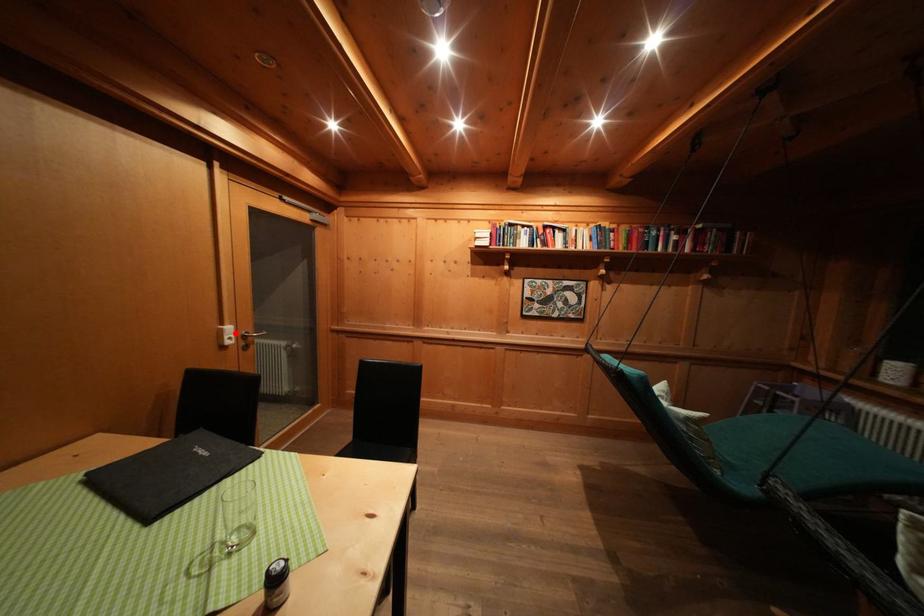
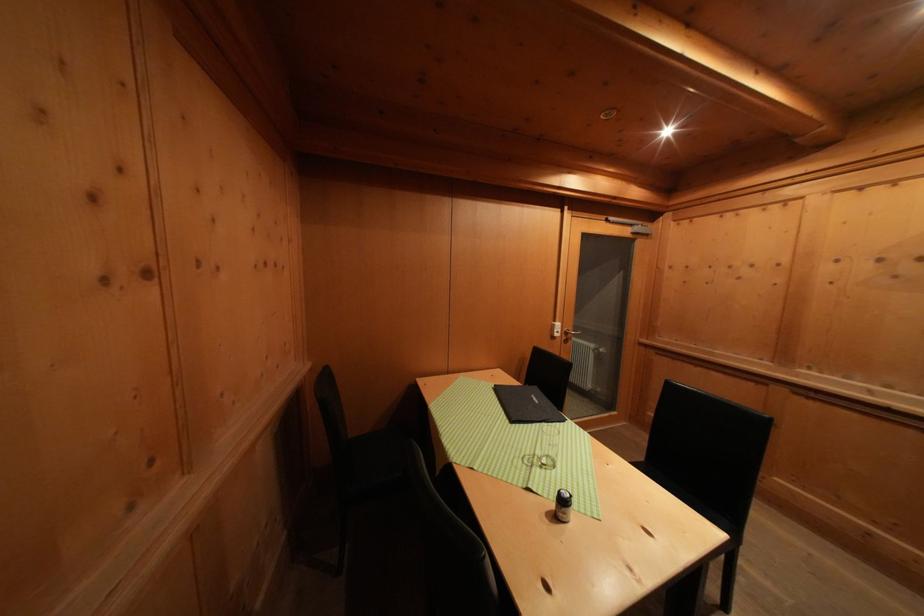
Where in the second image is the point corresponding to the highlighted location from the first image?

(564, 330)